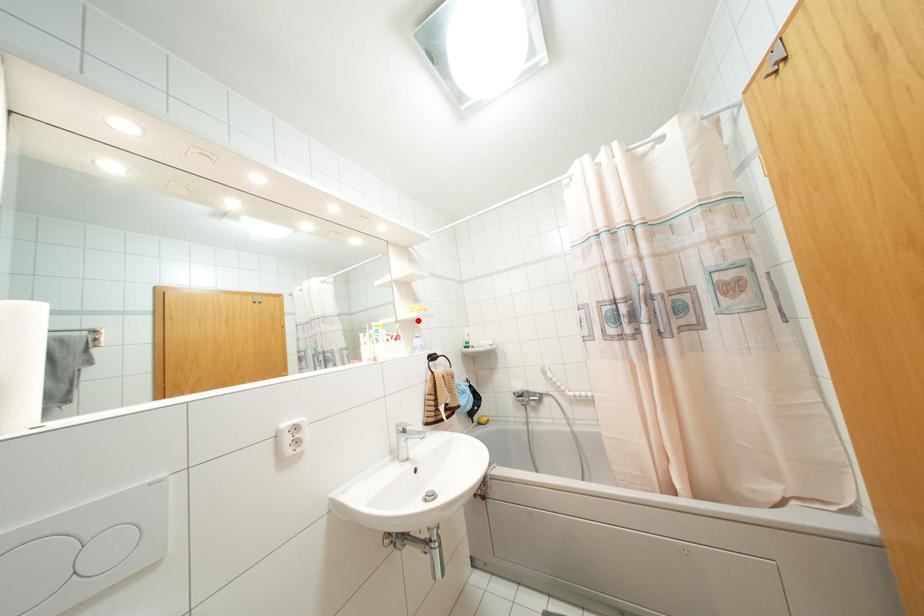
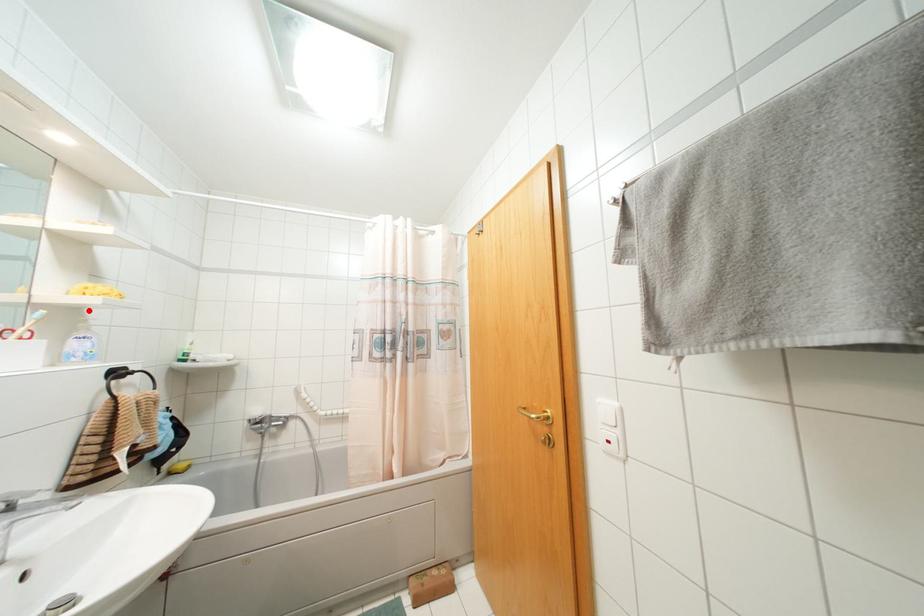
Looking at this image, I am providing you with two images of the same scene from different viewpoints. A red point is marked on the first image and another point is marked on the second image. Is the marked point in image1 the same physical position as the marked point in image2?

Yes